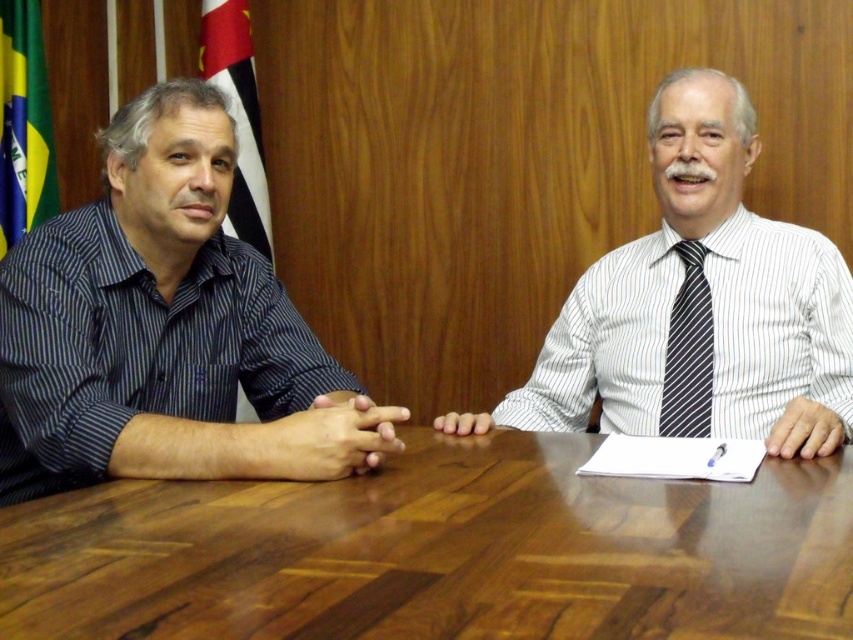
Question: Which point is closer to the camera?

Choices:
 (A) (683, 378)
 (B) (32, 156)

Answer: (A)

Question: Observing the image, what is the correct spatial positioning of brown wood table at center in reference to striped fabric tie at center?

Choices:
 (A) right
 (B) left

Answer: (B)

Question: Which point is closer to the camera taking this photo?

Choices:
 (A) coord(271,452)
 (B) coord(247,202)

Answer: (A)

Question: Is dark blue striped shirt at left thinner than white striped shirt at center?

Choices:
 (A) no
 (B) yes

Answer: (B)

Question: Which object is the farthest from the yellow-green fabric flag at left?

Choices:
 (A) striped fabric tie at center
 (B) red fabric flag at left
 (C) dark blue striped shirt at left
 (D) brown wood table at center

Answer: (A)

Question: Does dark blue striped shirt at left have a smaller size compared to striped fabric tie at center?

Choices:
 (A) no
 (B) yes

Answer: (A)